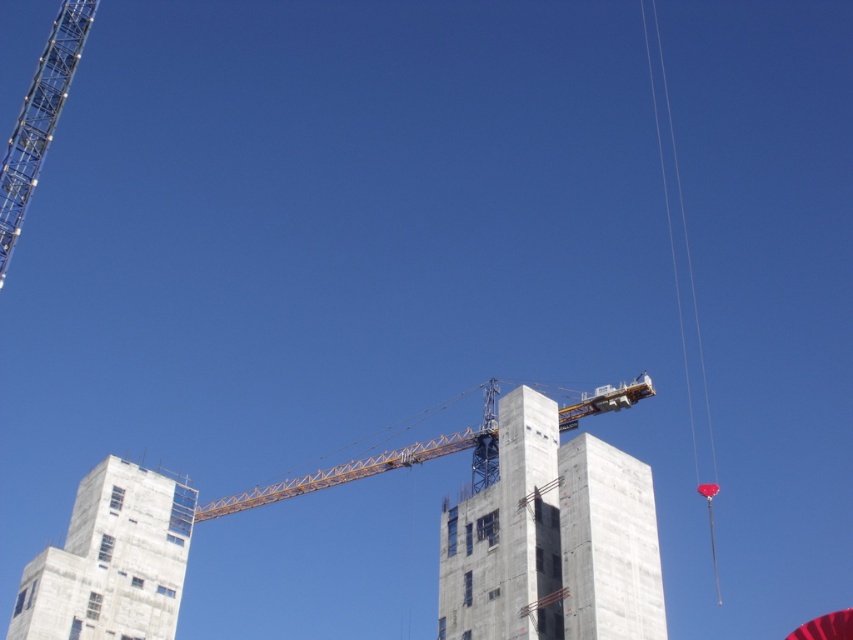
Question: Is metallic silver crane at upper left positioned behind yellow metallic crane at center?

Choices:
 (A) yes
 (B) no

Answer: (B)

Question: Is concrete at center above concrete building at lower left?

Choices:
 (A) yes
 (B) no

Answer: (B)

Question: Which of the following is the farthest from the observer?

Choices:
 (A) (86, 490)
 (B) (62, 81)
 (C) (422, 451)

Answer: (A)

Question: Does metallic silver crane at upper left appear on the right side of yellow metallic crane at center?

Choices:
 (A) no
 (B) yes

Answer: (A)

Question: Among these points, which one is nearest to the camera?

Choices:
 (A) (509, 502)
 (B) (160, 544)
 (C) (468, 436)
 (D) (51, 49)

Answer: (A)

Question: Which of the following is the closest to the observer?

Choices:
 (A) (265, 499)
 (B) (577, 554)
 (C) (146, 518)

Answer: (B)